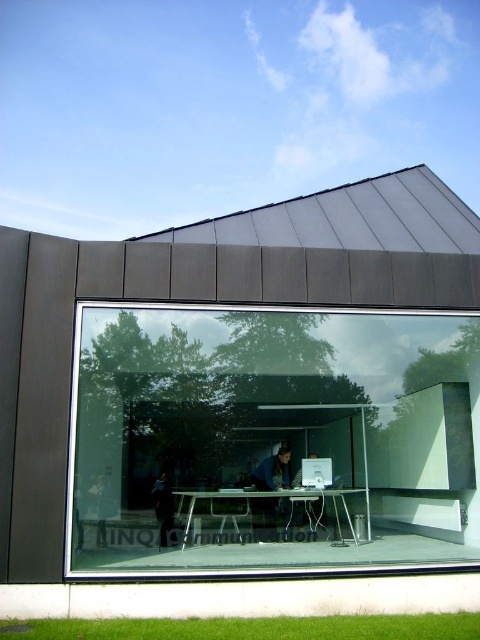
Question: Which of these objects is positioned farthest from the dark blue fabric at center?

Choices:
 (A) dark blue fabric jacket at center
 (B) dark gray jacket at lower left
 (C) transparent glass door at center

Answer: (B)

Question: Can you confirm if dark blue fabric at center is positioned to the right of white glossy computer at center?

Choices:
 (A) no
 (B) yes

Answer: (A)

Question: Based on their relative distances, which object is farther from the metallic silver table at center?

Choices:
 (A) dark gray jacket at lower left
 (B) dark blue fabric jacket at center

Answer: (B)

Question: Which point is farther from the camera taking this photo?

Choices:
 (A) (458, 408)
 (B) (108, 500)

Answer: (B)

Question: Where is dark blue fabric at center located in relation to dark gray jacket at lower left in the image?

Choices:
 (A) left
 (B) right

Answer: (B)

Question: Considering the relative positions of metallic silver table at center and white glossy computer at center in the image provided, where is metallic silver table at center located with respect to white glossy computer at center?

Choices:
 (A) left
 (B) right

Answer: (A)